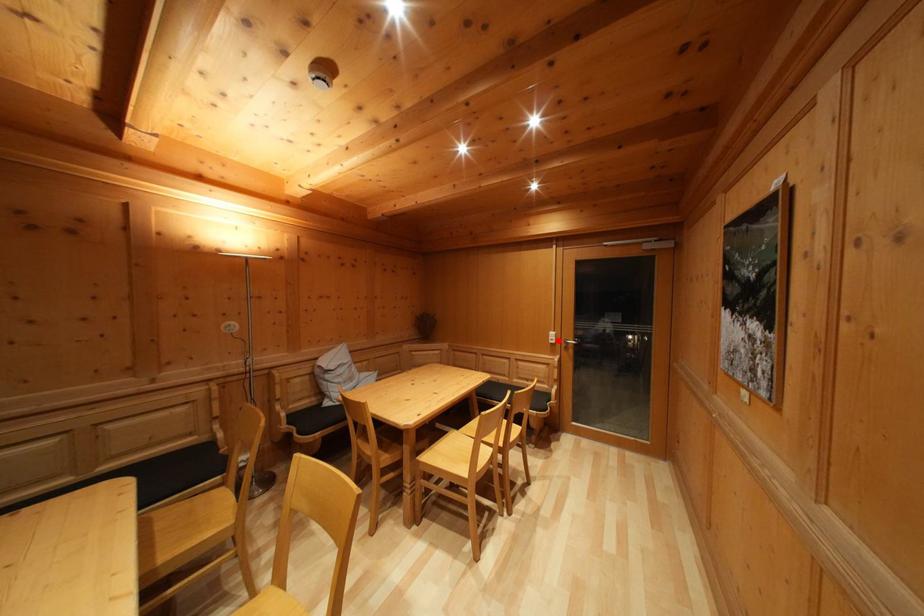
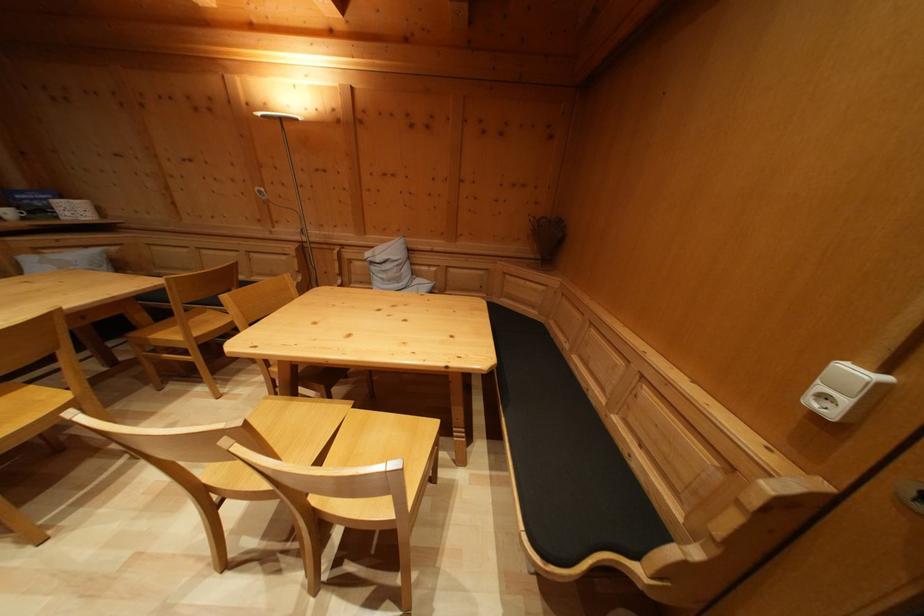
Question: I am providing you with two images of the same scene from different viewpoints. Image1 has a red point marked. In image2, the corresponding 3D location appears at what relative position? Reply with the corresponding letter.

Choices:
 (A) Closer
 (B) Farther

Answer: (B)